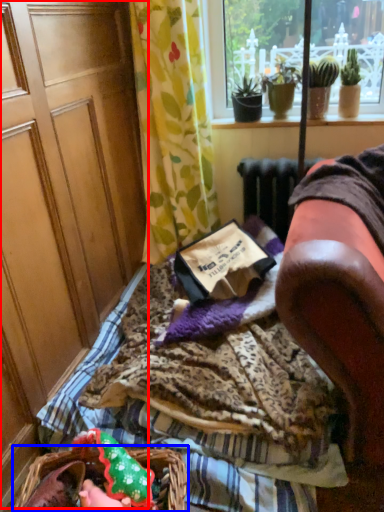
Question: Which object appears farthest to the camera in this image, screen door (highlighted by a red box) or flower basket (highlighted by a blue box)?

Choices:
 (A) screen door
 (B) flower basket

Answer: (B)